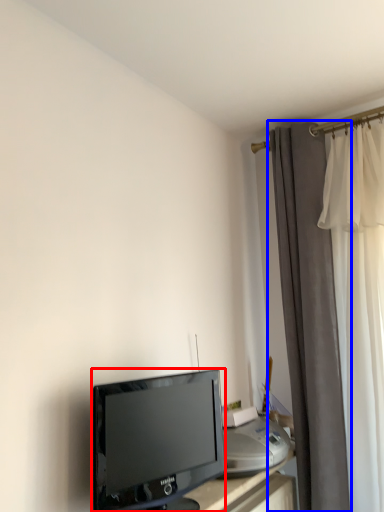
Question: Which object appears closest to the camera in this image, television (highlighted by a red box) or curtain (highlighted by a blue box)?

Choices:
 (A) television
 (B) curtain

Answer: (A)